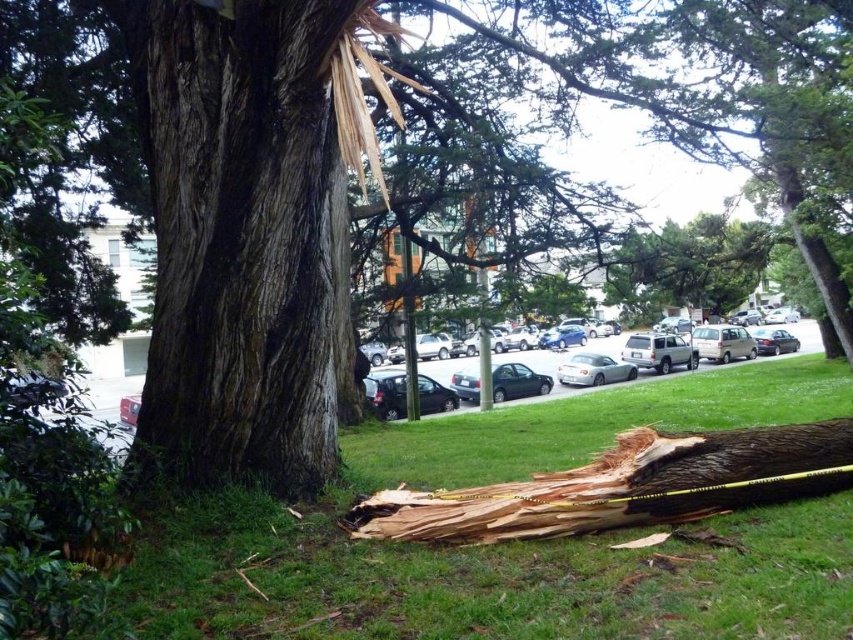
You are a pedestrian trying to cross the road where the silver metallic sedan at center is parked. There is a fallen tree trunk blocking your path. Can you walk around the dark brown rough bark tree trunk at center to reach the other side of the road?

The dark brown rough bark tree trunk at center is in front of the silver metallic sedan at center, so you can walk around the tree trunk to reach the other side of the road.